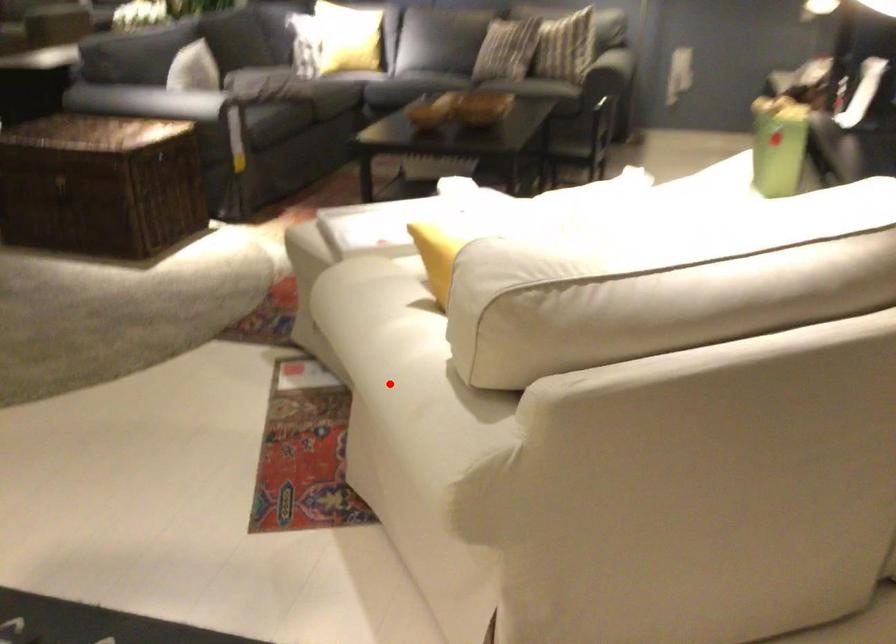
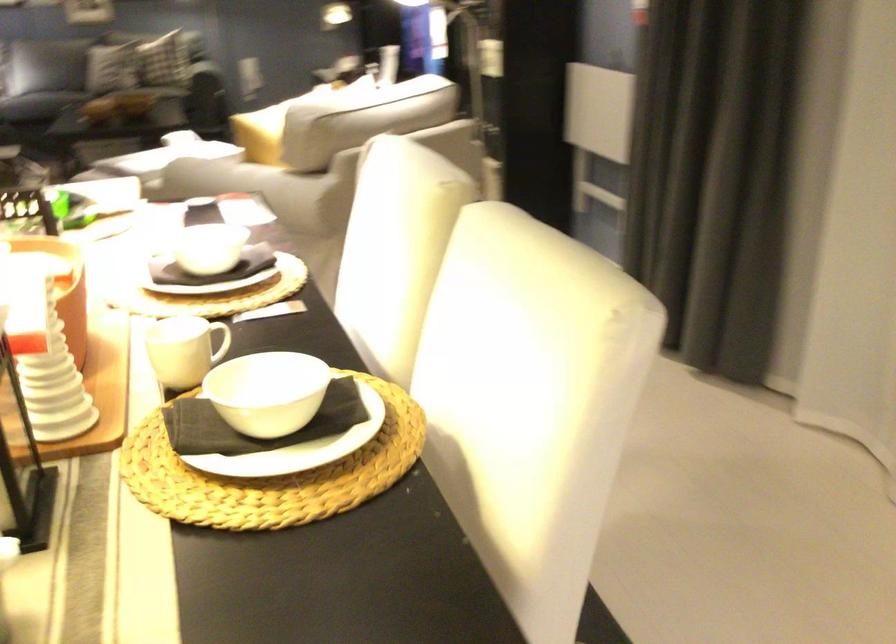
Question: I am providing you with two images of the same scene from different viewpoints. Given a red point in image1, look at the same physical point in image2. Is it:

Choices:
 (A) Closer to the viewpoint
 (B) Farther from the viewpoint

Answer: (B)